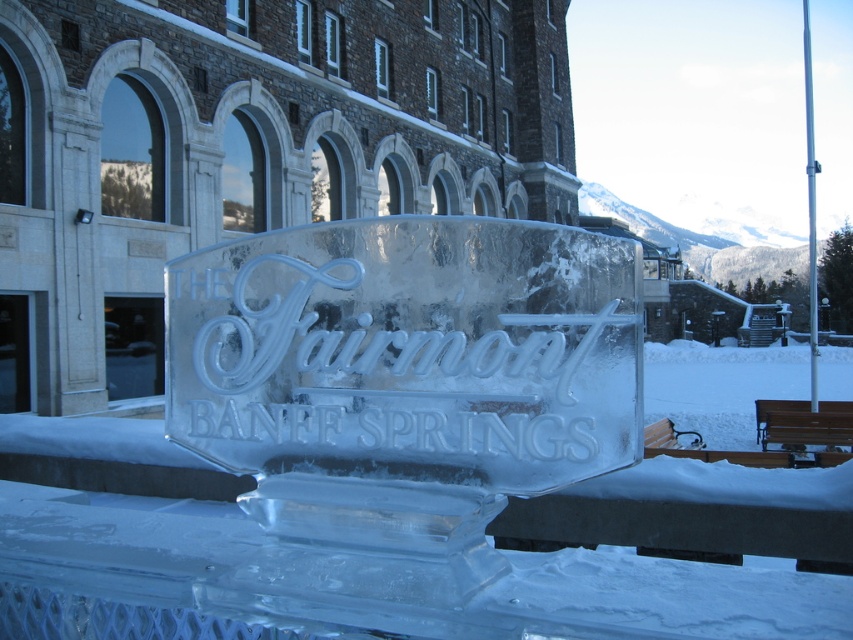
You are a visitor at the winter event and want to sit on the brown wooden bench at lower right. However, you need to ensure that the transparent ice at center won

The transparent ice at center might be wider than brown wooden bench at lower right, so there is a possibility that the ice sculpture could block access to the bench. Check the actual distance before approaching.

You are standing in front of the grand stone building with arched windows and doorways. You see a transparent ice at center and a brown wooden bench at lower right. Which object is closer to the right side of the image?

The transparent ice at center is closer to the right side of the image because it is positioned to the right of the brown wooden bench at lower right.